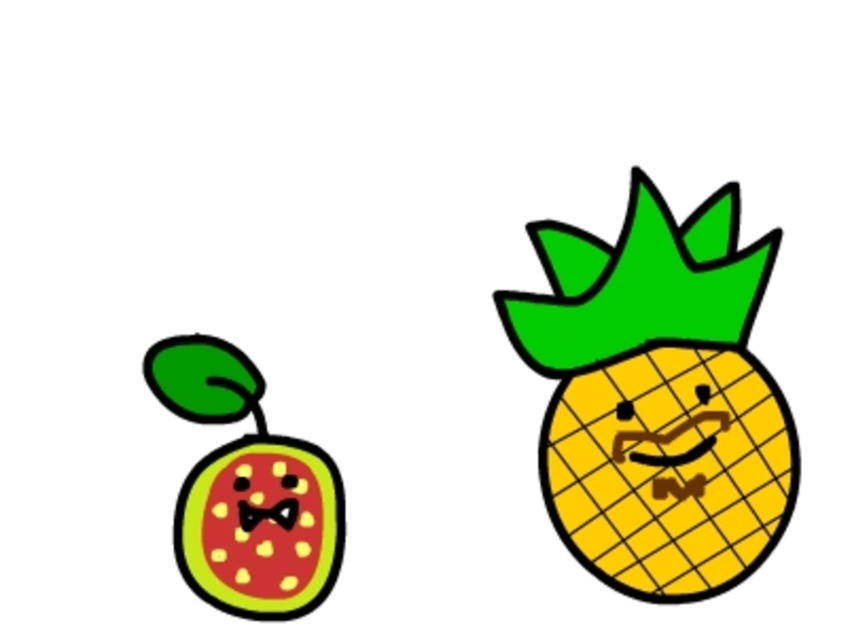
Based on the photo, can you confirm if yellow grid pineapple at right is positioned below polka-dotted fabric face at left?

Incorrect, yellow grid pineapple at right is not positioned below polka-dotted fabric face at left.

Is point (654, 476) positioned before point (275, 573)?

No.

What are the coordinates of `yellow grid pineapple at right` in the screenshot? It's located at (658, 397).

Is matte green watermelon at left bigger than polka-dotted fabric face at left?

Yes, matte green watermelon at left is bigger than polka-dotted fabric face at left.

Is matte green watermelon at left to the left of polka-dotted fabric face at left from the viewer's perspective?

Correct, you'll find matte green watermelon at left to the left of polka-dotted fabric face at left.

Measure the distance between matte green watermelon at left and camera.

matte green watermelon at left is 33.41 inches away from camera.

Image resolution: width=852 pixels, height=640 pixels. In order to click on matte green watermelon at left in this screenshot , I will do `click(246, 490)`.

Describe the element at coordinates (658, 397) in the screenshot. I see `yellow grid pineapple at right` at that location.

Measure the distance from yellow grid pineapple at right to matte green watermelon at left.

yellow grid pineapple at right is 8.23 inches from matte green watermelon at left.

Is point (619, 552) farther from viewer compared to point (160, 371)?

Yes, point (619, 552) is behind point (160, 371).

Image resolution: width=852 pixels, height=640 pixels. In order to click on yellow grid pineapple at right in this screenshot , I will do `click(658, 397)`.